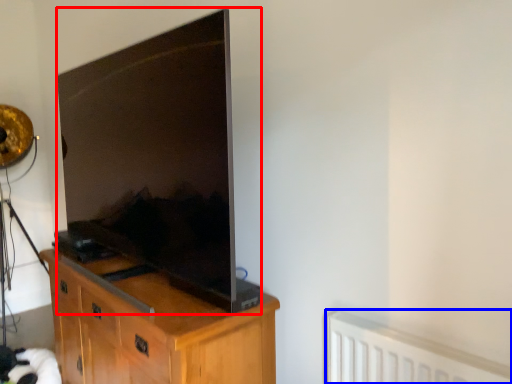
Question: Which point is further to the camera, television (highlighted by a red box) or radiator (highlighted by a blue box)?

Choices:
 (A) television
 (B) radiator

Answer: (A)